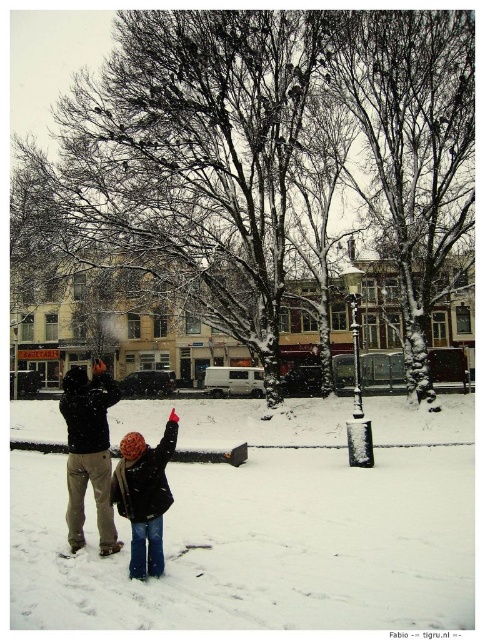
Question: Which of the following is the closest to the observer?

Choices:
 (A) (151, 552)
 (B) (17, 515)

Answer: (A)

Question: Estimate the real-world distances between objects in this image. Which object is farther from the dark brown leather jacket at center?

Choices:
 (A) white fluffy snow at center
 (B) black woolen hat at center

Answer: (A)

Question: Can you confirm if white fluffy snow at center is smaller than dark brown leather jacket at center?

Choices:
 (A) yes
 (B) no

Answer: (A)

Question: Is dark brown leather jacket at center positioned before black woolen hat at center?

Choices:
 (A) no
 (B) yes

Answer: (A)

Question: Considering the real-world distances, which object is closest to the black woolen hat at center?

Choices:
 (A) dark brown leather jacket at center
 (B) white fluffy snow at center

Answer: (A)

Question: Does white fluffy snow at center have a greater width compared to dark brown leather jacket at center?

Choices:
 (A) yes
 (B) no

Answer: (A)